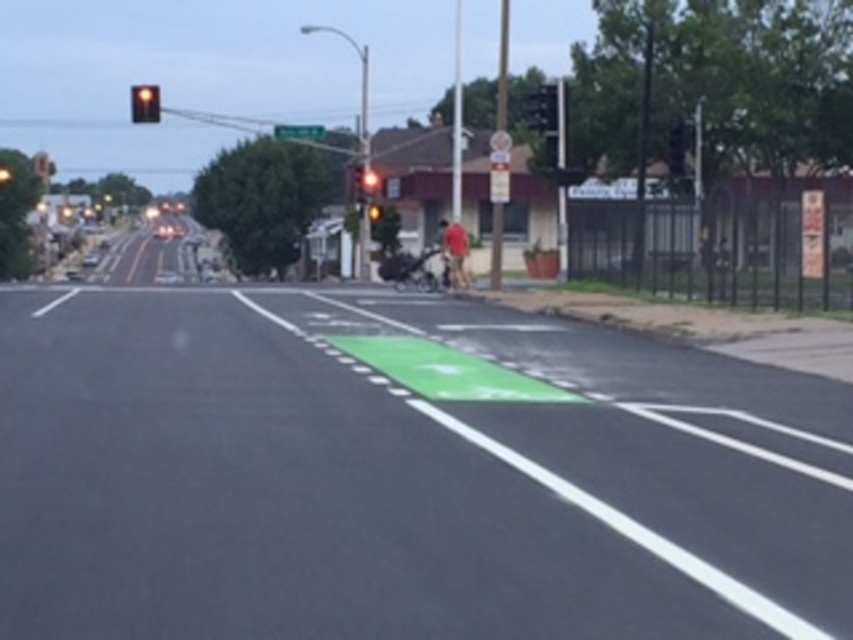
You are a pedestrian standing at the edge of the sidewalk near the pedestrian crossing. You need to cross the street to reach a store located to the right of the amber glass traffic light at upper center. Based on the scene, can you determine if the green asphalt at center is positioned in a way that allows you to walk straight towards the store without deviating from your path?

The green asphalt at center is to the right of the amber glass traffic light at upper center. Therefore, walking straight towards the store located to the right of the amber glass traffic light at upper center would lead you across the green asphalt at center.

You are a delivery drone operator. Your drone needs to fly from the green asphalt at center to the amber glass traffic light at upper center. What is the approximate distance your drone must cover?

The distance between the green asphalt at center and the amber glass traffic light at upper center is 132.77 feet, so the drone must cover approximately 132.77 feet.

Looking at this image, you are a delivery driver approaching the intersection shown in the image. You notice the metallic pole at right and the green plastic street sign at upper center. Which object is taller?

The metallic pole at right is much taller than the green plastic street sign at upper center.